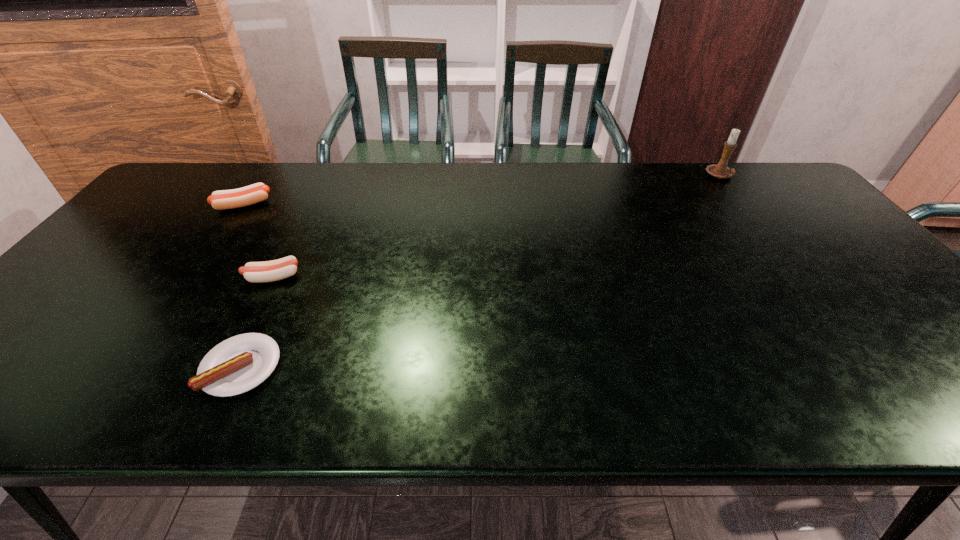
Find the location of a particular element. This screenshot has width=960, height=540. sausage that is the second closest one to the tallest object is located at coordinates (236, 365).

Identify which sausage is located as the second nearest to the second farthest sausage. Please provide its 2D coordinates. Your answer should be formatted as a tuple, i.e. [(x, y)], where the tuple contains the x and y coordinates of a point satisfying the conditions above.

[(224, 199)]

Identify the location of vacant space that satisfies the following two spatial constraints: 1. on the front side of the third nearest object; 2. on the right side of the shortest sausage. The image size is (960, 540). (131, 367).

Image resolution: width=960 pixels, height=540 pixels. I want to click on vacant space that satisfies the following two spatial constraints: 1. on the front side of the leftmost sausage; 2. on the right side of the second farthest sausage, so tap(193, 277).

Locate an element on the screen. free space that satisfies the following two spatial constraints: 1. on the front side of the second nearest object; 2. on the left side of the shortest sausage is located at coordinates (228, 367).